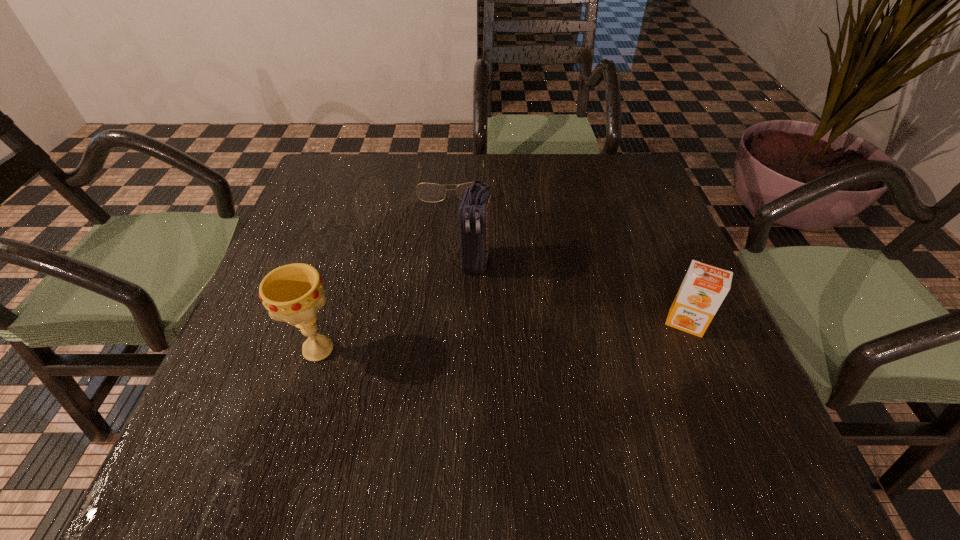
This screenshot has width=960, height=540. Identify the location of vacant space on the desktop that is between the leftmost object and the rightmost object and is positioned on the front-facing side of the shortest object. (453, 340).

You are a GUI agent. You are given a task and a screenshot of the screen. Output one action in this format:
    pyautogui.click(x=<x>, y=<y>)
    Task: Click on the vacant space on the desktop that is between the chalice and the third tallest object and is positioned with the zip open on the third nearest object
    
    Given the screenshot: What is the action you would take?
    pyautogui.click(x=454, y=340)